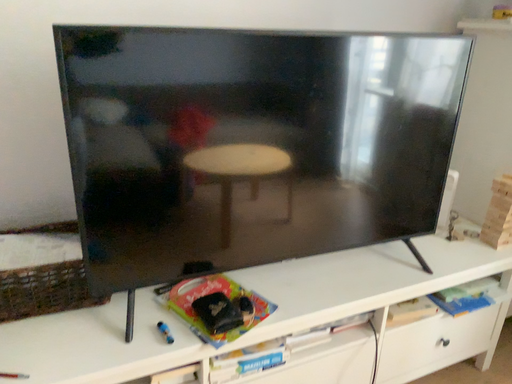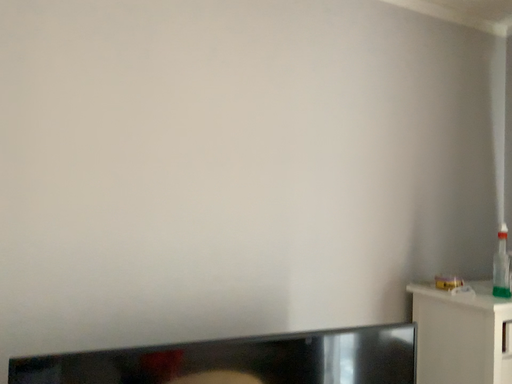
Question: Which way did the camera rotate in the video?

Choices:
 (A) rotated downward
 (B) rotated upward

Answer: (B)